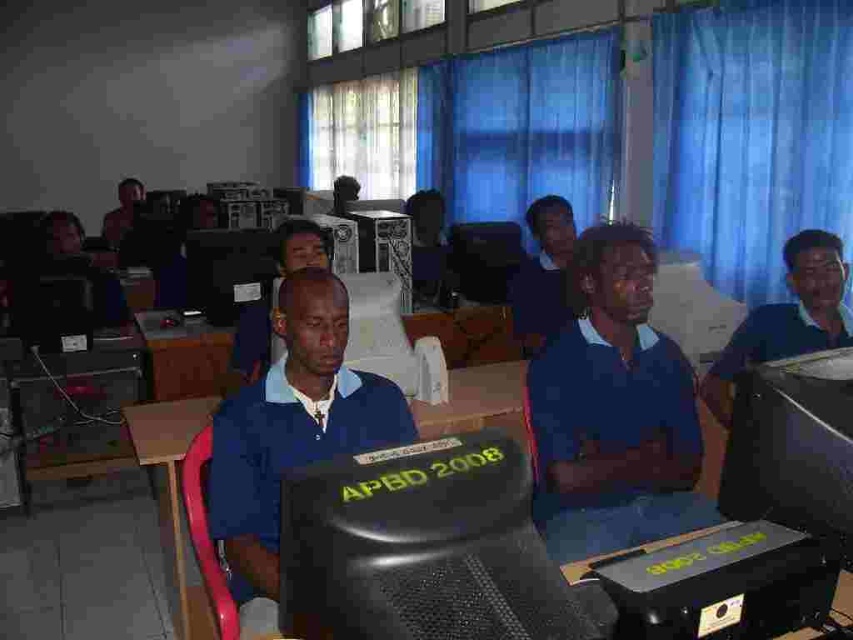
You are standing at the back of the classroom and want to hand a document to the person wearing the blue shirt at center. There is a matte black monitor at center in your way. Can you reach the person without moving the monitor?

The blue shirt at center is closer to the viewer than the matte black monitor at center, so you can reach the person without moving the monitor because they are in front of it.

You are a photographer standing at the back of the classroom. You want to take a photo of the blue shirt at center and the matte black monitor at center. Based on their sizes in the image, which one will appear bigger in your photo?

The blue shirt at center will appear bigger in the photo because it is larger in size than the matte black monitor at center.

You are standing at the entrance of the classroom and see two points marked on the floor. The first point is at position point (723, 420) and the second is at point (120, 243). Which point is closer to you?

Point (723, 420) is in front of point (120, 243), so the point closer to you is point (120, 243).